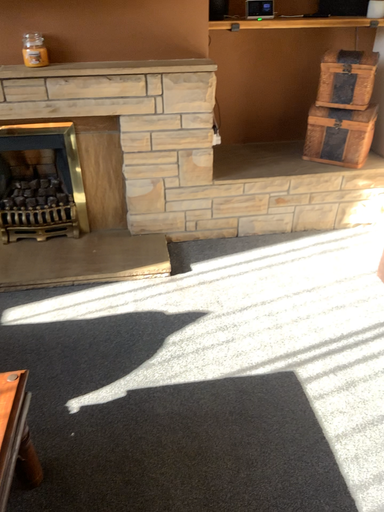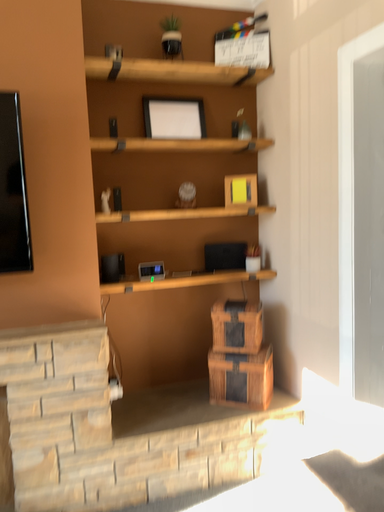
Question: How did the camera likely rotate when shooting the video?

Choices:
 (A) rotated upward
 (B) rotated downward

Answer: (A)